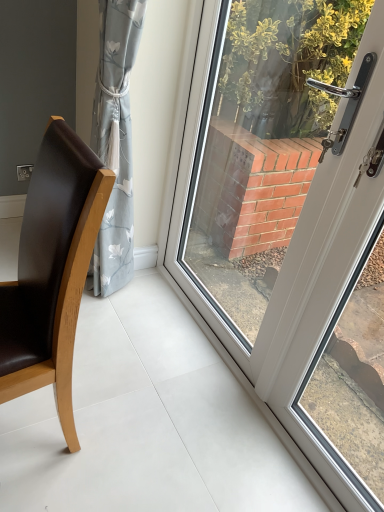
You are a GUI agent. You are given a task and a screenshot of the screen. Output one action in this format:
    pyautogui.click(x=<x>, y=<y>)
    Task: Click on the vacant space behind brown leather chair at left
    The image size is (384, 512).
    Given the screenshot: What is the action you would take?
    pyautogui.click(x=107, y=346)